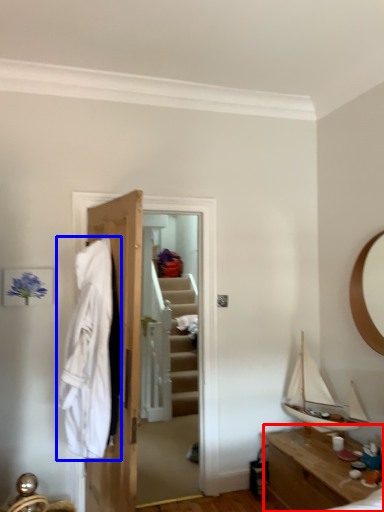
Question: Which point is closer to the camera, table (highlighted by a red box) or clothing (highlighted by a blue box)?

Choices:
 (A) table
 (B) clothing

Answer: (B)